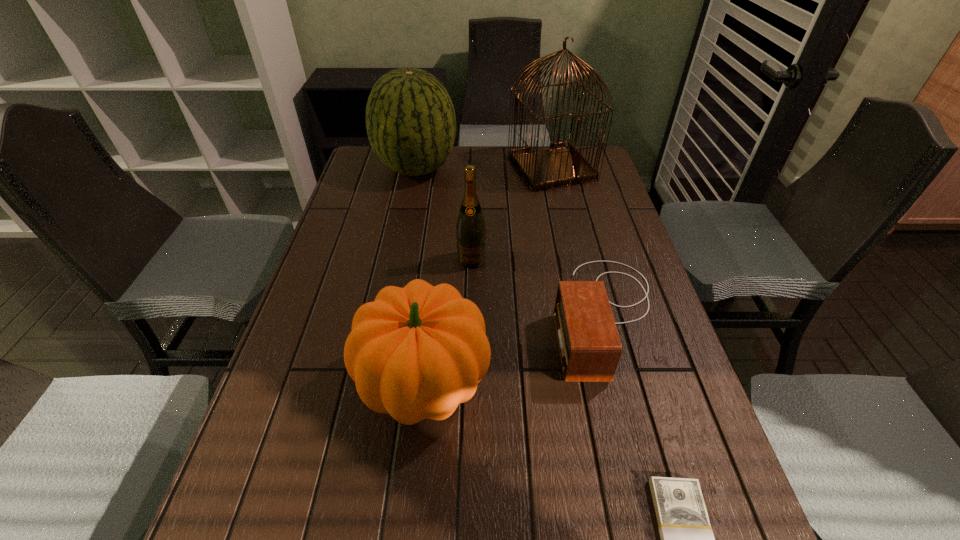
Find the location of a particular element. The height and width of the screenshot is (540, 960). the closest object to the radio receiver is located at coordinates (416, 352).

Select which object is the fifth closest to the wine bottle. Please provide its 2D coordinates. Your answer should be formatted as a tuple, i.e. [(x, y)], where the tuple contains the x and y coordinates of a point satisfying the conditions above.

[(687, 539)]

Where is `free spot that satisfies the following two spatial constraints: 1. on the front side of the pumpkin; 2. on the right side of the watermelon`? This screenshot has width=960, height=540. free spot that satisfies the following two spatial constraints: 1. on the front side of the pumpkin; 2. on the right side of the watermelon is located at coordinates (x=373, y=383).